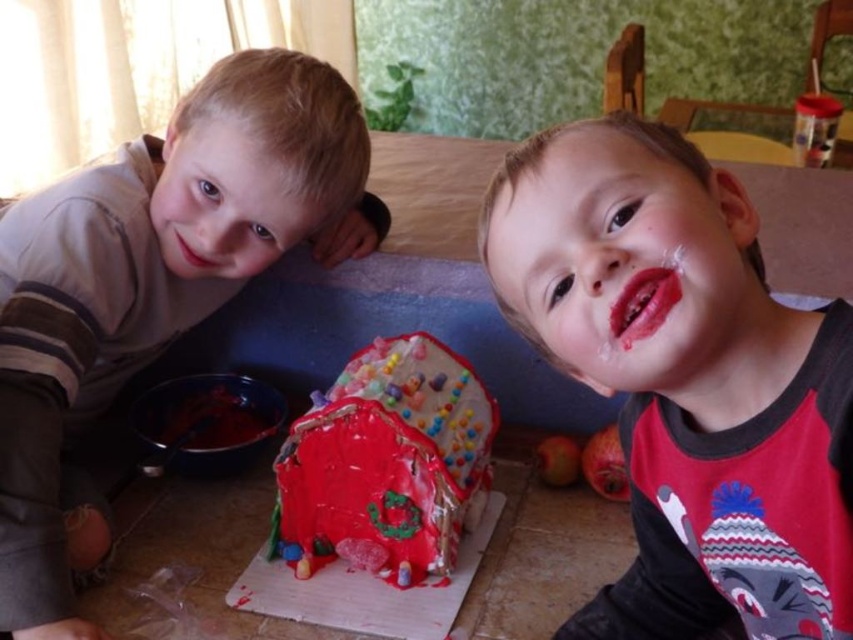
Is point (647, 417) closer to camera compared to point (682, 300)?

No.

Can you confirm if matte red shirt at center is shorter than glossy plastic face at center?

No.

What do you see at coordinates (685, 380) in the screenshot? I see `matte red shirt at center` at bounding box center [685, 380].

What are the coordinates of `matte red shirt at center` in the screenshot? It's located at (685, 380).

Can you confirm if matte gray sweater at left is positioned to the right of glossy plastic face at center?

In fact, matte gray sweater at left is to the left of glossy plastic face at center.

Who is more distant from viewer, (44, 266) or (668, 198)?

Positioned behind is point (44, 266).

Does point (347, 156) come closer to viewer compared to point (527, 163)?

No, (347, 156) is further to viewer.

Find the location of a particular element. The image size is (853, 640). matte gray sweater at left is located at coordinates (154, 282).

Is point (718, 330) less distant than point (473, 397)?

Yes, point (718, 330) is in front of point (473, 397).

Who is positioned more to the left, glossy plastic face at center or shiny red gingerbread house at center?

shiny red gingerbread house at center

This screenshot has height=640, width=853. In order to click on glossy plastic face at center in this screenshot , I will do `click(618, 252)`.

In order to click on glossy plastic face at center in this screenshot , I will do click(618, 252).